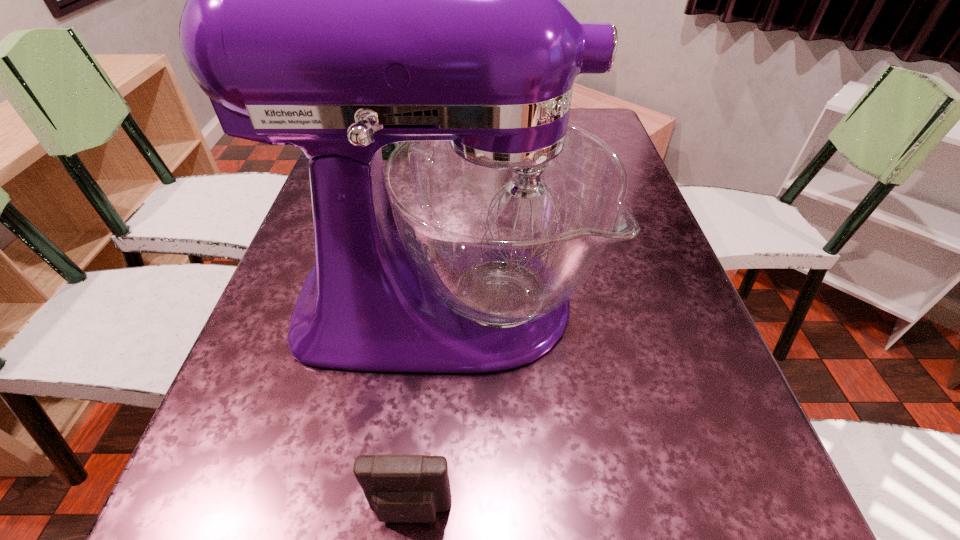
Locate an element on the screen. The width and height of the screenshot is (960, 540). the second nearest object is located at coordinates (338, 0).

The image size is (960, 540). In order to click on mixer in this screenshot , I will do `click(338, 0)`.

Where is `the second tallest object`? the second tallest object is located at coordinates (387, 150).

The image size is (960, 540). I want to click on the farthest object, so click(x=387, y=150).

Where is `pouch`? This screenshot has height=540, width=960. pouch is located at coordinates (410, 488).

Find the location of `the nearest object`. the nearest object is located at coordinates (410, 488).

Locate an element on the screen. The width and height of the screenshot is (960, 540). free space located at the bowl opening of the tallest object is located at coordinates (626, 303).

At what (x,y) coordinates should I click in order to perform the action: click on vacant area situated 0.400m on the face of the farthest object. Please return your answer as a coordinate pair (x, y). Looking at the image, I should click on (355, 261).

The height and width of the screenshot is (540, 960). Identify the location of object located in the far edge section of the desktop. (387, 150).

Where is `object that is at the near edge`? The height and width of the screenshot is (540, 960). object that is at the near edge is located at coordinates 410,488.